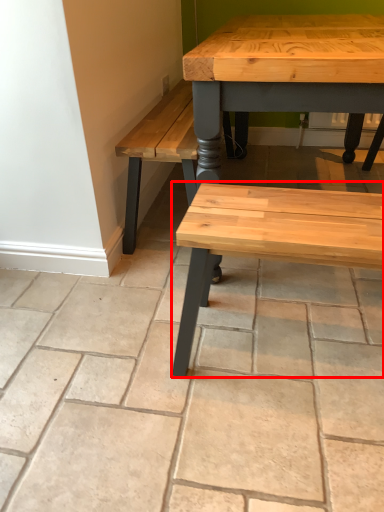
Question: From the image's perspective, what is the correct spatial positioning of bench (annotated by the red box) in reference to concrete?

Choices:
 (A) above
 (B) below

Answer: (B)